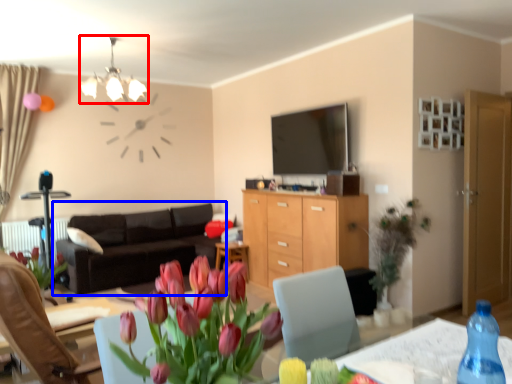
Question: Which object is further to the camera taking this photo, light fixture (highlighted by a red box) or studio couch (highlighted by a blue box)?

Choices:
 (A) light fixture
 (B) studio couch

Answer: (B)